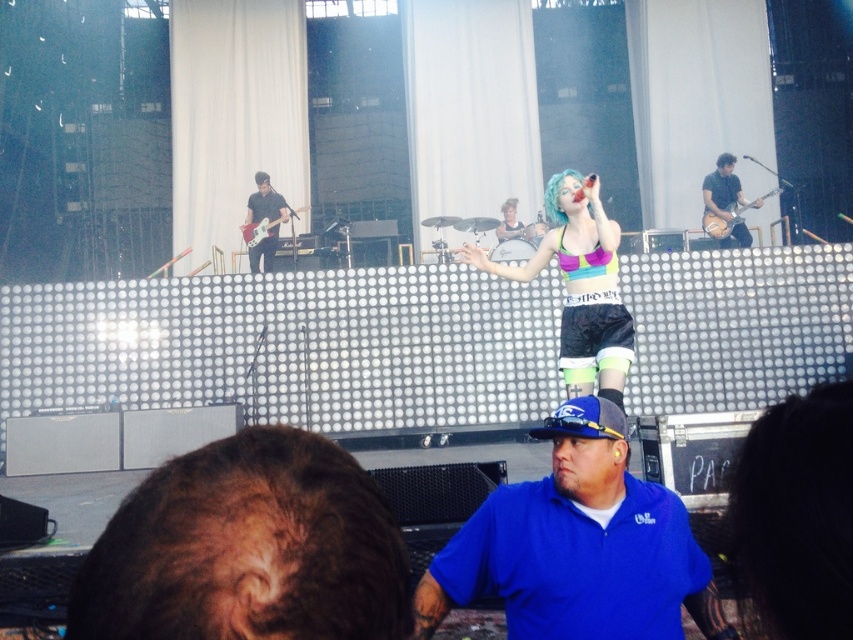
Question: Which object appears closest to the camera in this image?

Choices:
 (A) shiny silver guitar at center
 (B) glossy electric guitar at upper left
 (C) shiny black guitar at upper right
 (D) blue fabric shirt at lower center

Answer: (D)

Question: Which point is farther from the camera taking this photo?

Choices:
 (A) (258, 241)
 (B) (550, 188)

Answer: (A)

Question: Does blue fabric shirt at lower center appear on the left side of matte black guitar at left?

Choices:
 (A) yes
 (B) no

Answer: (B)

Question: Can you confirm if neon blue hair at center is positioned below matte black guitar at left?

Choices:
 (A) no
 (B) yes

Answer: (B)

Question: Considering the relative positions of matte black guitar at left and shiny silver guitar at center in the image provided, where is matte black guitar at left located with respect to shiny silver guitar at center?

Choices:
 (A) right
 (B) left

Answer: (B)

Question: Which object is the closest to the blue fabric shirt at lower center?

Choices:
 (A) matte black guitar at left
 (B) neon blue hair at center
 (C) light brown wood electric guitar at upper right
 (D) glossy electric guitar at upper left

Answer: (B)